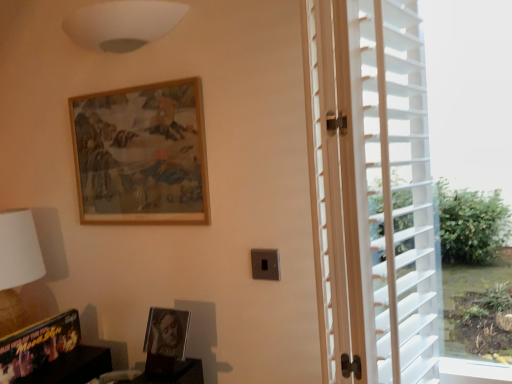
Question: From the image's perspective, relative to wooden picture frame at lower left, marked as the 3th picture frame in a top-to-bottom arrangement, is wooden frame at upper center, which is the third picture frame in bottom-to-top order, above or below?

Choices:
 (A) below
 (B) above

Answer: (B)

Question: Is point (71, 117) closer or farther from the camera than point (19, 370)?

Choices:
 (A) closer
 (B) farther

Answer: (B)

Question: Estimate the real-world distances between objects in this image. Which object is farther from the wooden picture frame at lower left, the 1th picture frame in the bottom-to-top sequence?

Choices:
 (A) white plastic blinds at right
 (B) white wooden blinds at right
 (C) matte black picture frame at lower center, which ranks as the 2th picture frame in top-to-bottom order
 (D) dark wood bookshelf at lower left
 (E) white matte lampshade at upper center

Answer: (A)

Question: Estimate the real-world distances between objects in this image. Which object is farther from the dark wood bookshelf at lower left?

Choices:
 (A) white matte lampshade at upper center
 (B) wooden frame at upper center, placed as the 1th picture frame when sorted from top to bottom
 (C) white plastic blinds at right
 (D) white wooden blinds at right
 (E) matte black picture frame at lower center, arranged as the second picture frame when ordered from the bottom

Answer: (C)